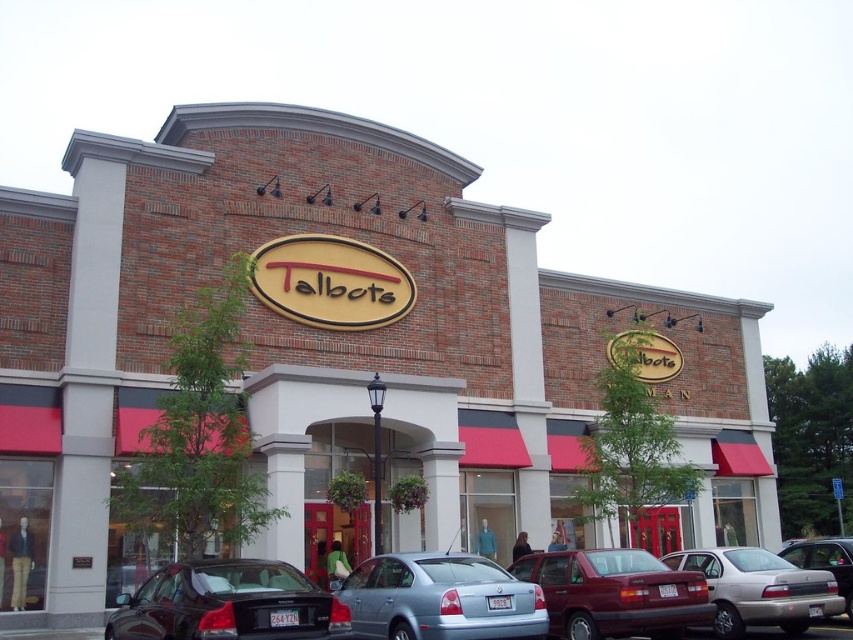
You are driving a car and want to park in front of the Talbots store. The parking lot has a designated parking spot at point 0.920, 0.891. Is the silver metallic sedan at center currently occupying that spot?

The silver metallic sedan at center is positioned at point (759, 588), so yes, it is occupying the designated parking spot at that location.

You are a delivery driver who needs to park your truck in the parking lot behind the Talbots store. The parking lot has a narrow entrance. You see a matte red sedan at center and a metallic silver sedan at lower right. Which vehicle should you move first to access the parking lot entrance?

The matte red sedan at center is positioned over the metallic silver sedan at lower right, so you should move the metallic silver sedan at lower right first to allow access to the parking lot entrance.

You are a customer arriving at the Talbots store and see the silver metallic sedan at center and the metallic silver sedan at lower right in the parking lot. Which car is closer to the entrance of the store?

The silver metallic sedan at center is positioned over the metallic silver sedan at lower right, meaning it is closer to the entrance of the store.